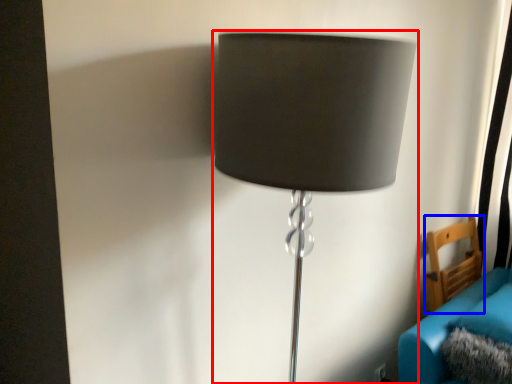
Question: Which point is further to the camera, lamp (highlighted by a red box) or furniture (highlighted by a blue box)?

Choices:
 (A) lamp
 (B) furniture

Answer: (B)